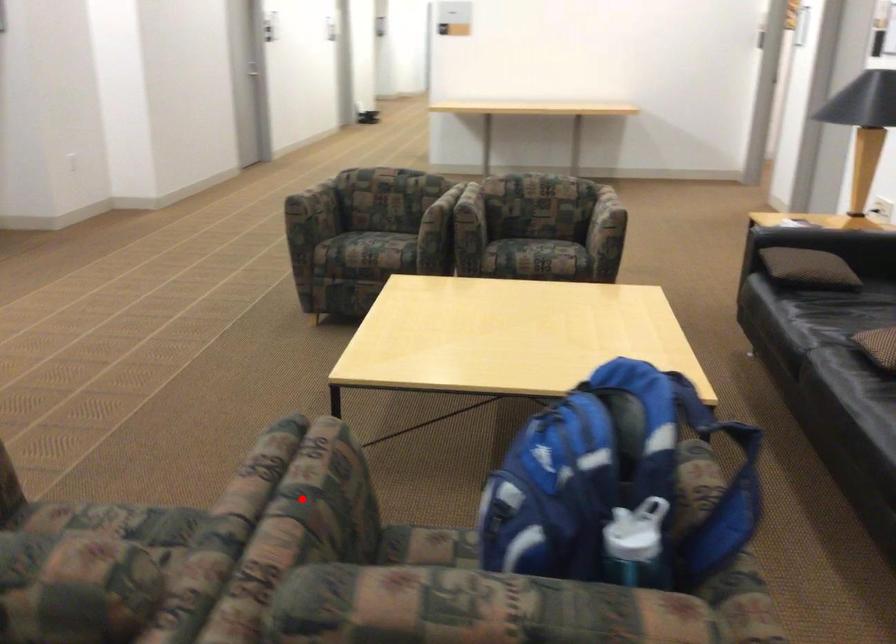
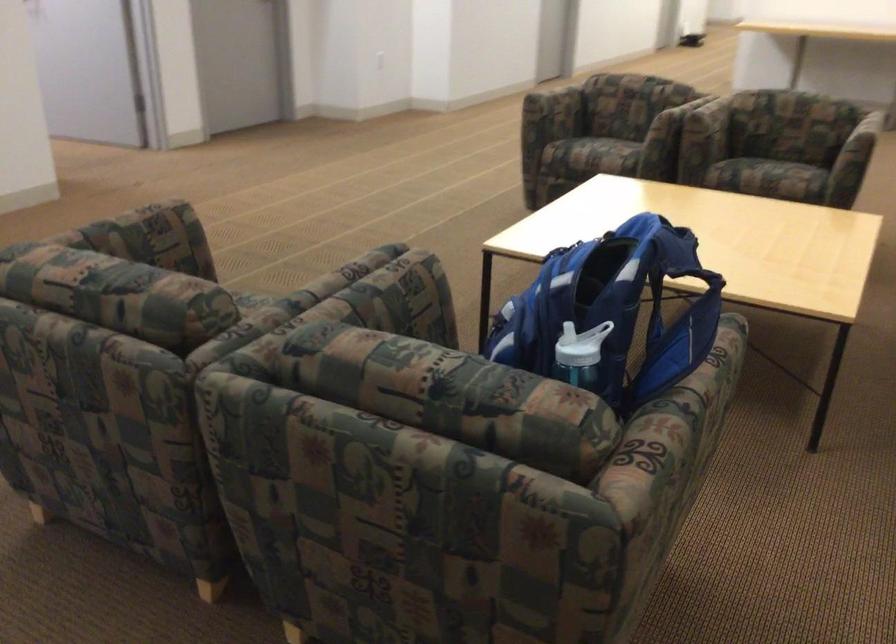
Question: A red point is marked in image1. In image2, is the corresponding 3D point closer to the camera or farther? Reply with the corresponding letter.

Choices:
 (A) The corresponding 3D point is closer.
 (B) The corresponding 3D point is farther.

Answer: (B)